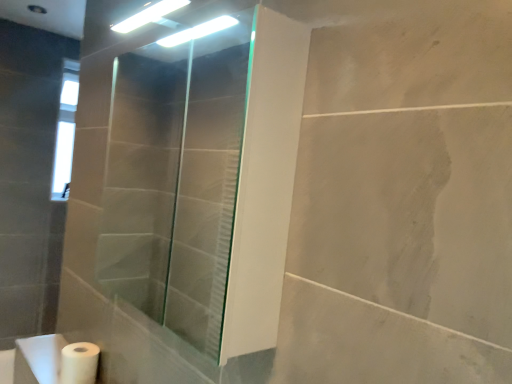
Question: In the image, is transparent glass shower door at center positioned in front of or behind white matte toilet paper at lower left?

Choices:
 (A) behind
 (B) front

Answer: (B)

Question: Is point (130, 102) closer or farther from the camera than point (89, 380)?

Choices:
 (A) farther
 (B) closer

Answer: (A)

Question: Which is farther from the white matte toilet paper at lower left?

Choices:
 (A) transparent glass shower door at center
 (B) white matte sink at lower left

Answer: (A)

Question: Which object is positioned closest to the white matte sink at lower left?

Choices:
 (A) white matte toilet paper at lower left
 (B) transparent glass shower door at center

Answer: (A)